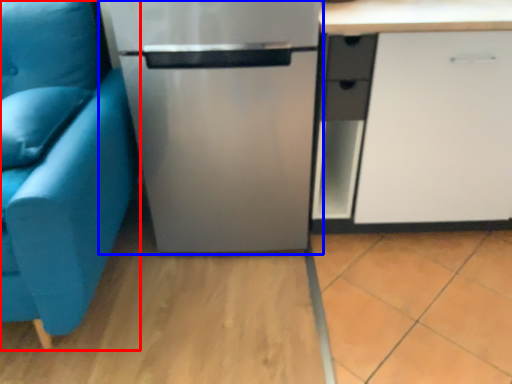
Question: Which of the following is the closest to the observer, studio couch (highlighted by a red box) or refrigerator (highlighted by a blue box)?

Choices:
 (A) studio couch
 (B) refrigerator

Answer: (A)